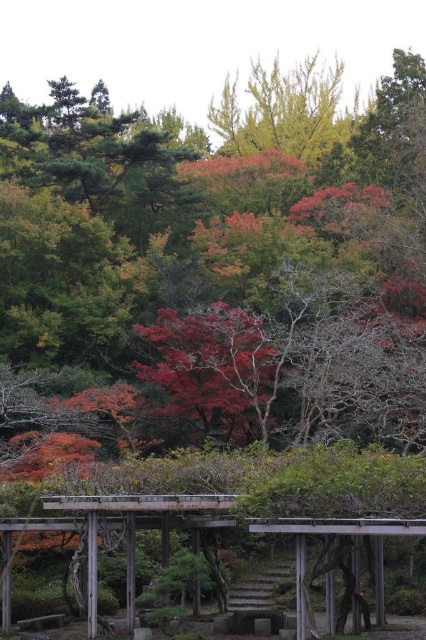
What is the exact location of the shiny red maple at center in the image?

The shiny red maple at center is located at point (213,368).

Based on the photo, you are standing at the point labeled point (238, 416) and want to walk towards the point labeled point (284, 116). Given the layout of the scene described, will you have an unobstructed path? Please explain your reasoning based on the objects and their positions.

Since point (238, 416) is in front of point (284, 116), walking from point (238, 416) towards point (284, 116) would mean moving away from the viewer. The dense autumn foliage in the middle ground and the aged wooden structure in the foreground might block the path, but since the structure is open and the points are positioned such that one is in front of the other, there could be a clear path through the open areas of the structure. However, without specific details about obstacles between them, it